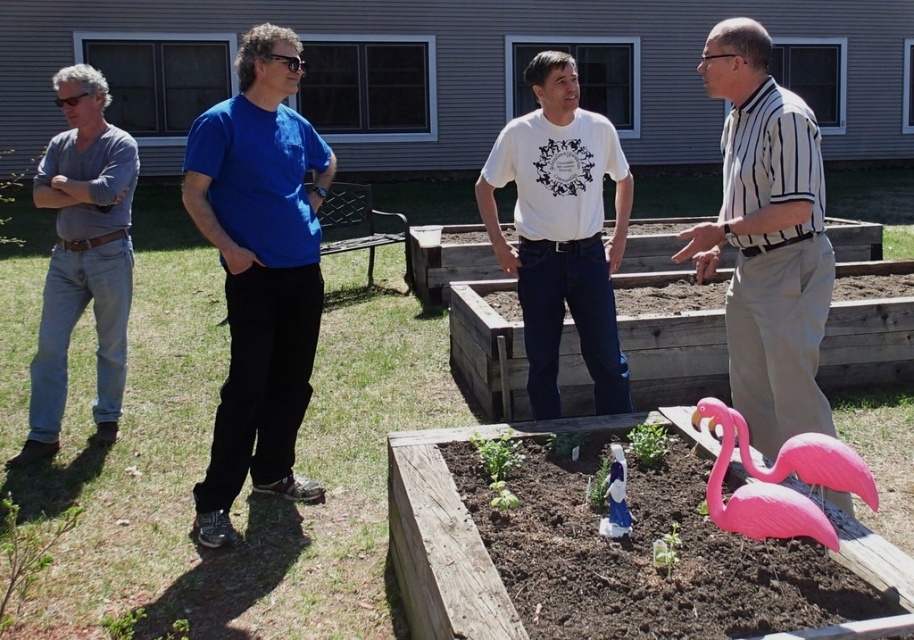
Question: Which point is closer to the camera?

Choices:
 (A) (271, 307)
 (B) (716, 408)

Answer: (B)

Question: Can you confirm if blue t-shirt at center is positioned below white cotton t-shirt at center?

Choices:
 (A) no
 (B) yes

Answer: (B)

Question: Is striped cotton shirt at right above white cotton t-shirt at center?

Choices:
 (A) no
 (B) yes

Answer: (A)

Question: Is striped cotton shirt at right below denim jeans at left?

Choices:
 (A) yes
 (B) no

Answer: (A)

Question: Which of these objects is positioned farthest from the blue t-shirt at center?

Choices:
 (A) striped cotton shirt at right
 (B) pink plastic flamingo at lower right
 (C) white cotton t-shirt at center

Answer: (B)

Question: Which of the following is the closest to the observer?

Choices:
 (A) pink plastic flamingo at lower right
 (B) denim jeans at left
 (C) blue t-shirt at center

Answer: (A)